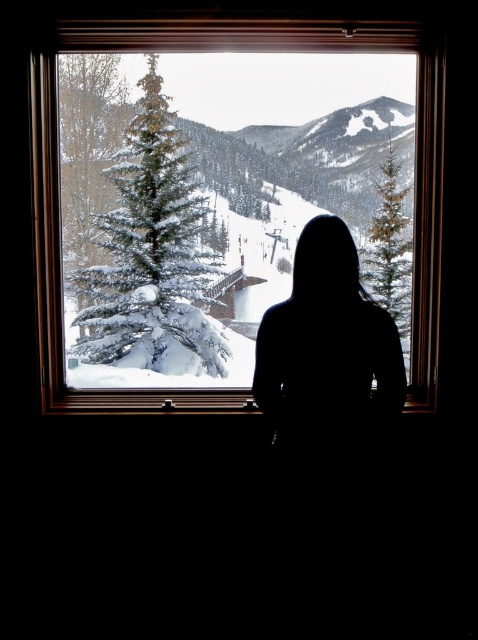
Question: Which of the following is the farthest from the observer?

Choices:
 (A) (349, 397)
 (B) (387, 250)
 (C) (118, 161)
 (D) (330, 44)

Answer: (C)

Question: Which is nearer to the silhouette figure at center?

Choices:
 (A) snow-covered evergreen at center
 (B) green textured pine at right

Answer: (B)

Question: Is snow-covered evergreen at center positioned in front of wooden frame at center?

Choices:
 (A) yes
 (B) no

Answer: (B)

Question: Does silhouette figure at center have a lesser width compared to green textured pine at right?

Choices:
 (A) no
 (B) yes

Answer: (A)

Question: Can you confirm if wooden frame at center is bigger than green textured pine at right?

Choices:
 (A) yes
 (B) no

Answer: (A)

Question: Among these points, which one is nearest to the camera?

Choices:
 (A) (408, 252)
 (B) (117, 237)
 (C) (381, 385)
 (D) (434, 77)

Answer: (C)